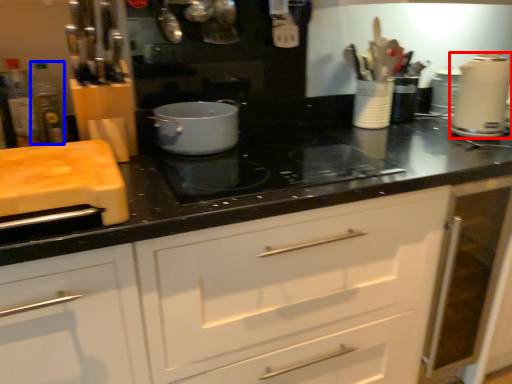
Question: Which point is further to the camera, kitchen appliance (highlighted by a red box) or bottle (highlighted by a blue box)?

Choices:
 (A) kitchen appliance
 (B) bottle

Answer: (A)